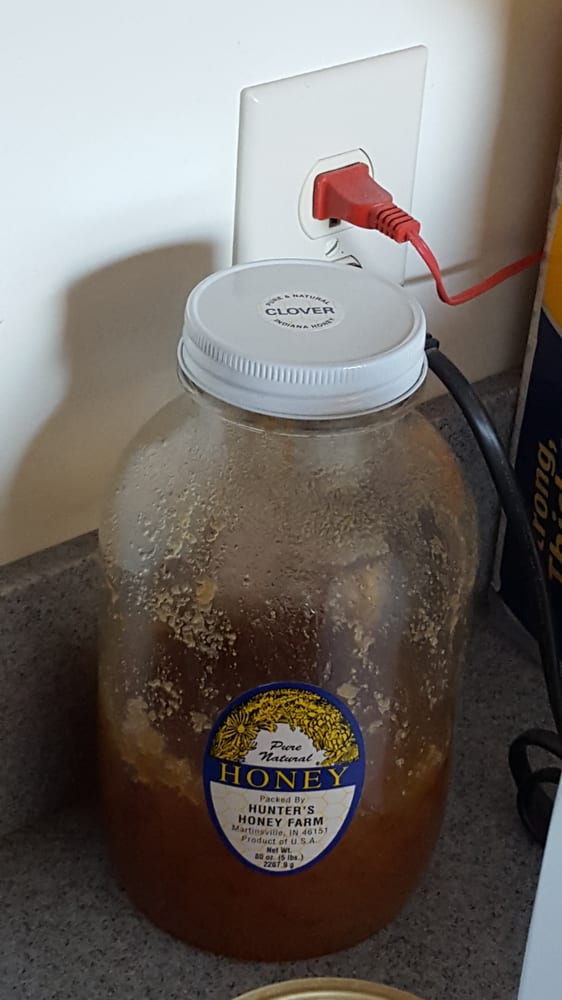
Where is `backsplash`? The height and width of the screenshot is (1000, 562). backsplash is located at coordinates (36, 745).